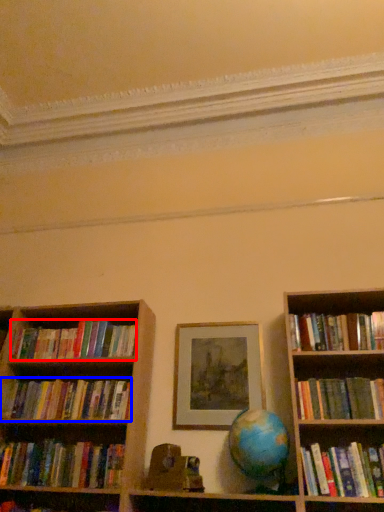
Question: Which object is further to the camera taking this photo, book (highlighted by a red box) or book (highlighted by a blue box)?

Choices:
 (A) book
 (B) book

Answer: (A)